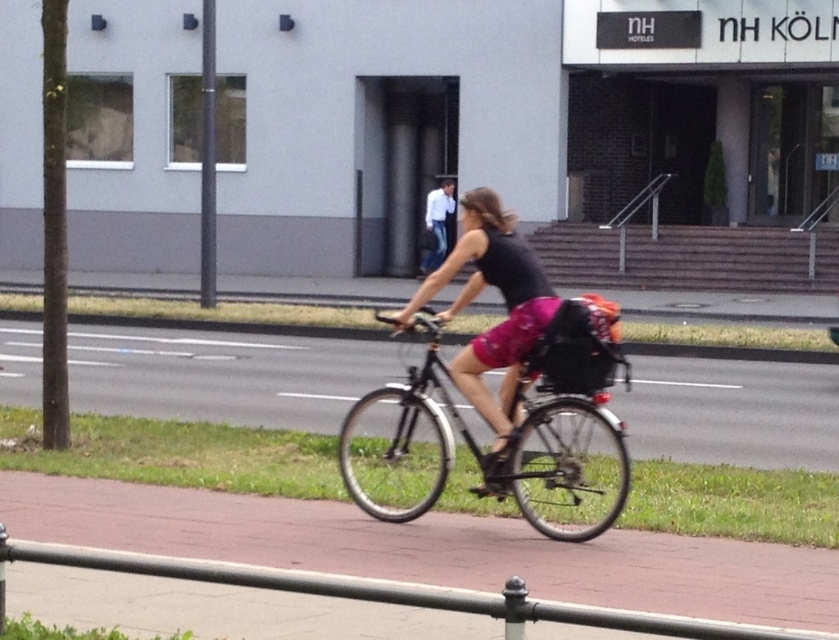
Who is lower down, shiny black bicycle at center or black metal rail at lower center?

black metal rail at lower center

Between point (540, 522) and point (300, 580), which one is positioned in front?

Point (300, 580)

Is point (559, 513) closer to viewer compared to point (147, 568)?

No, (559, 513) is behind (147, 568).

Where is `shiny black bicycle at center`? Image resolution: width=839 pixels, height=640 pixels. shiny black bicycle at center is located at coordinates (563, 460).

Is black metal rail at lower center shorter than matte black tank top at center?

Correct, black metal rail at lower center is not as tall as matte black tank top at center.

Can you confirm if black metal rail at lower center is smaller than matte black tank top at center?

Yes, black metal rail at lower center is smaller than matte black tank top at center.

Between point (65, 545) and point (514, 241), which one is positioned in front?

Point (65, 545) is in front.

Locate an element on the screen. black metal rail at lower center is located at coordinates (387, 593).

Does shiny black bicycle at center have a greater height compared to matte black tank top at center?

Incorrect, shiny black bicycle at center's height is not larger of matte black tank top at center's.

Is shiny black bicycle at center thinner than matte black tank top at center?

Incorrect, shiny black bicycle at center's width is not less than matte black tank top at center's.

In the scene shown: Who is more distant from viewer, (525, 504) or (493, 257)?

The point (493, 257) is behind.

Identify the location of shiny black bicycle at center. The image size is (839, 640). (563, 460).